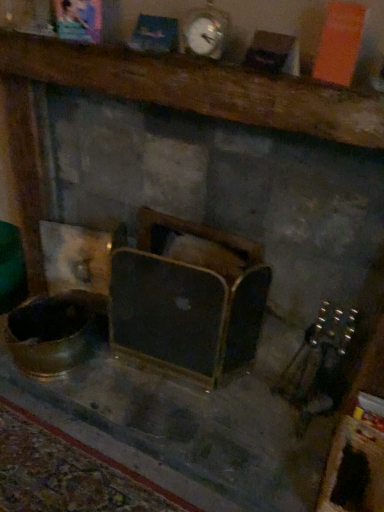
Find the location of a particular element. vacant space to the left of metallic silver clock at upper center is located at coordinates pos(160,54).